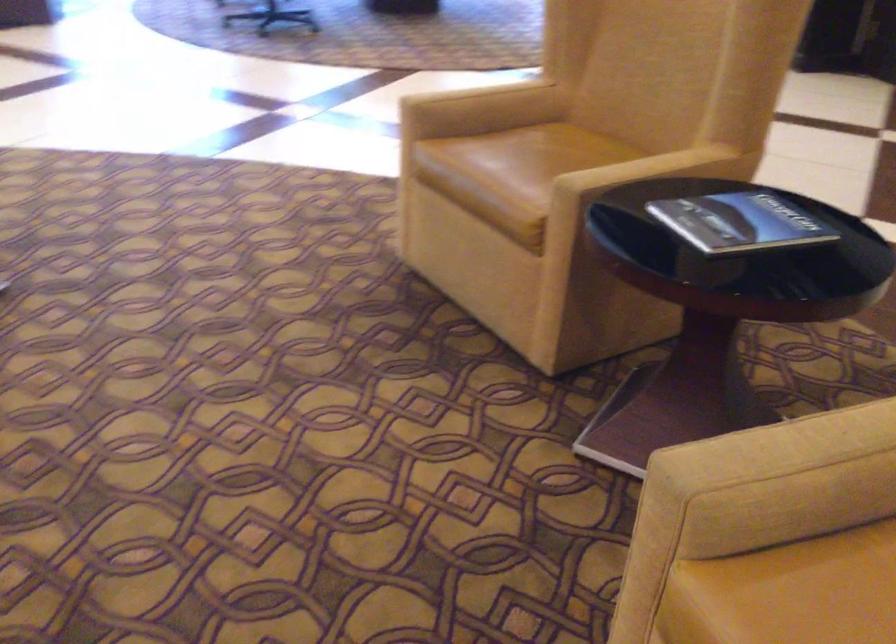
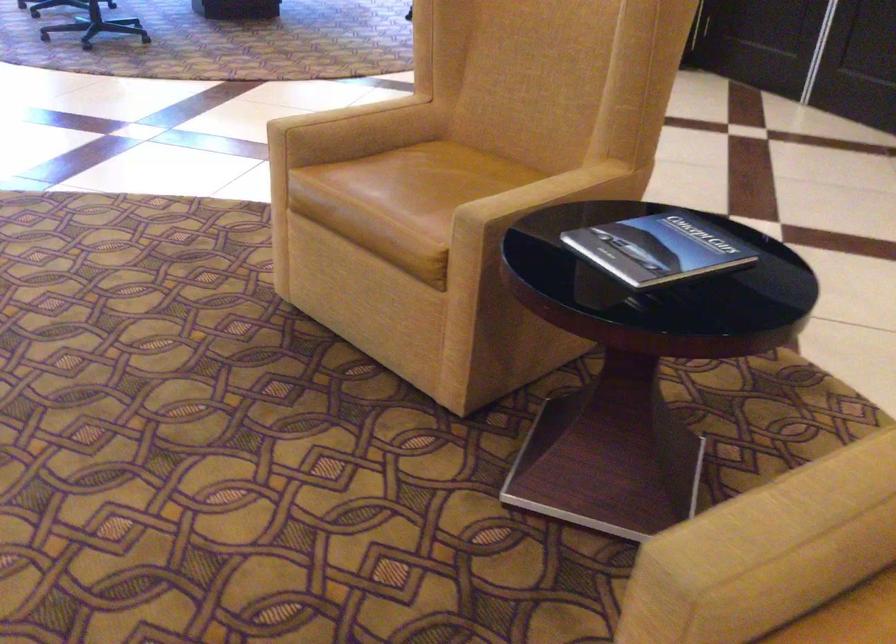
Locate, in the second image, the point that corresponds to point 736,219 in the first image.

(657, 249)